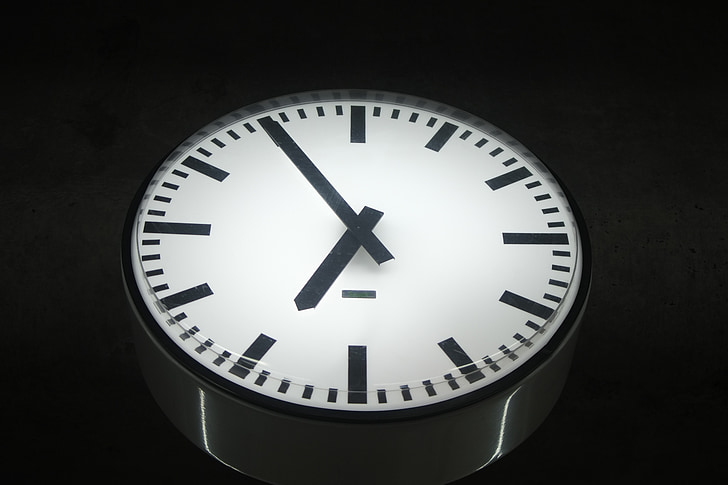
Where is `clock hands`? The height and width of the screenshot is (485, 728). clock hands is located at coordinates (292, 148), (375, 248), (368, 217), (360, 227), (312, 286), (300, 306).